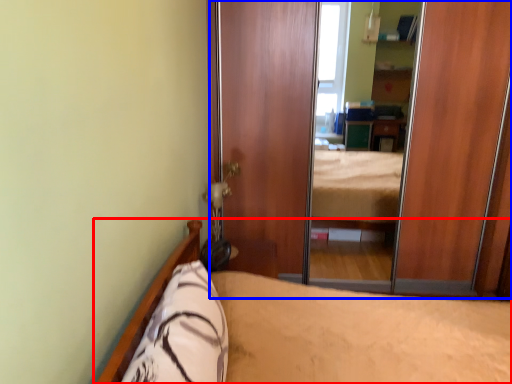
Question: Which object is further to the camera taking this photo, bed (highlighted by a red box) or screen door (highlighted by a blue box)?

Choices:
 (A) bed
 (B) screen door

Answer: (B)